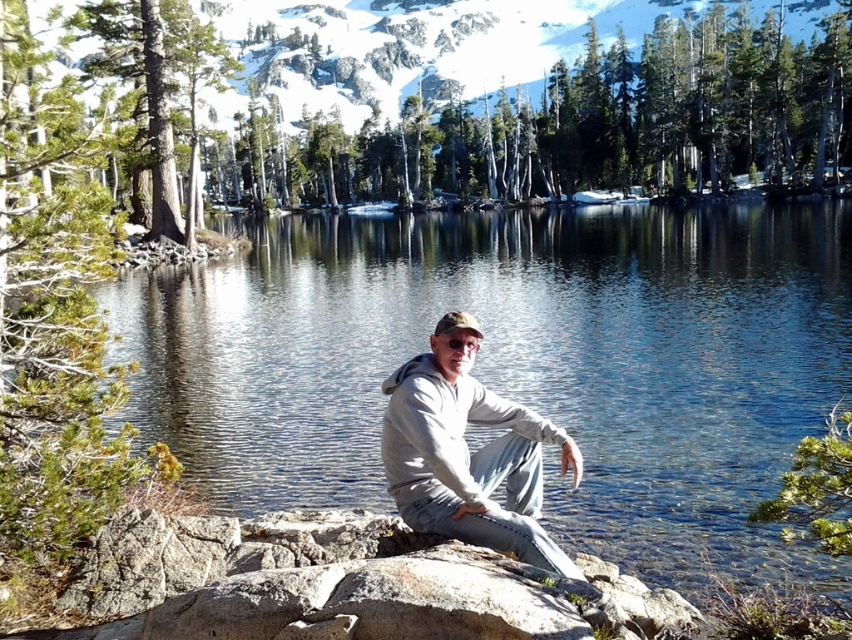
Consider the image. You are standing at the edge of the lake and want to reach the point marked as point (x=803, y=362). Given that your maximum walking distance is 50 meters, can you safely walk to that point without needing to swim?

The distance between you and point (x=803, y=362) is 49.87 meters, which is within your maximum walking distance of 50 meters. Therefore, you can safely walk to that point without needing to swim.

Based on the photo, you are a photographer standing at the edge of the lake and want to capture a closeup shot of the clear water at center. Given that your camera has a minimum focusing distance of 2 meters, can you take the photo without moving closer to the water?

The clear water at center is 25.02 meters away from the camera. Since the minimum focusing distance is 2 meters, the photographer can take the photo without moving closer because the water is well beyond the minimum distance required.